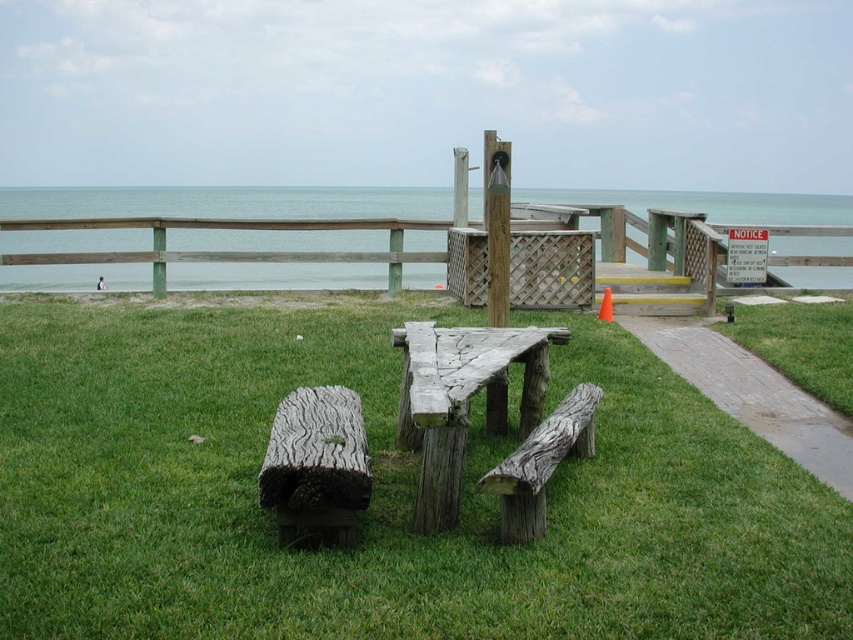
Question: Which point is farther to the camera?

Choices:
 (A) weathered wood bench at center
 (B) brick paved path at lower right

Answer: (B)

Question: Which point is farther to the camera?

Choices:
 (A) (302, 493)
 (B) (660, 516)
 (C) (6, 205)

Answer: (C)

Question: Is brick paved path at lower right further to the viewer compared to weathered wood bench at lower left?

Choices:
 (A) yes
 (B) no

Answer: (A)

Question: Does weathered wood picnic table at center have a greater width compared to brick paved path at lower right?

Choices:
 (A) yes
 (B) no

Answer: (A)

Question: Which point appears closest to the camera in this image?

Choices:
 (A) (403, 422)
 (B) (527, 456)
 (C) (403, 284)

Answer: (B)

Question: Can you confirm if green rough wood picnic table at center is positioned to the left of brick paved path at lower right?

Choices:
 (A) yes
 (B) no

Answer: (A)